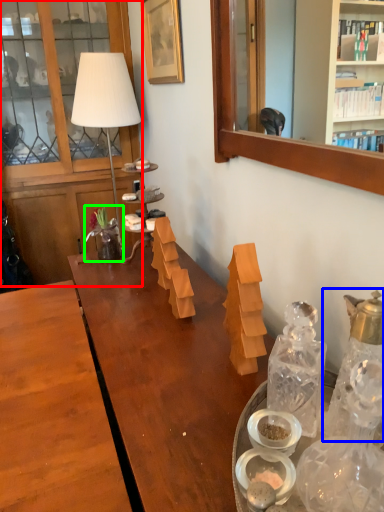
Question: Which object is the closest to the cabinetry (highlighted by a red box)? Choose among these: bottle (highlighted by a blue box) or flower (highlighted by a green box).

Choices:
 (A) bottle
 (B) flower

Answer: (B)